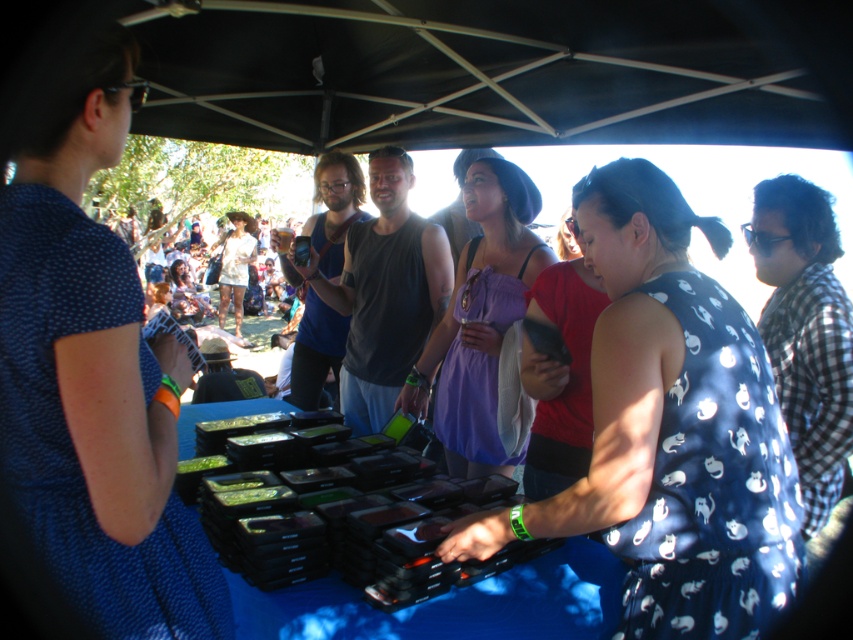
You are a customer at the market and want to buy a gadget from the table. The blue dotted dress at center and the matte white dress at center are both near the table. Which dress is shorter?

The blue dotted dress at center is not as tall as the matte white dress at center, so the blue dotted dress at center is shorter.

You are a customer at the market and want to know which dress takes up more space. You see a blue dotted dress at center and a matte white dress at center. Which one is larger in size?

The matte white dress at center is larger in size because the blue dotted dress at center occupies less space than it.